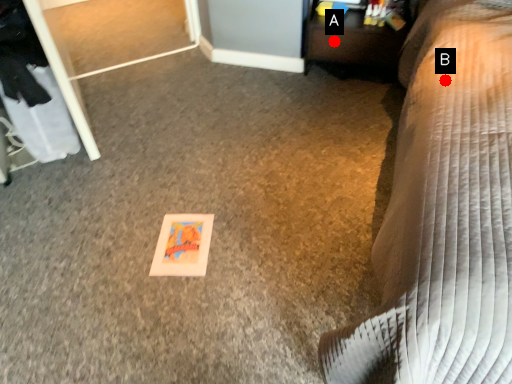
Question: Two points are circled on the image, labeled by A and B beside each circle. Which of the following is the closest to the observer?

Choices:
 (A) A is closer
 (B) B is closer

Answer: (B)